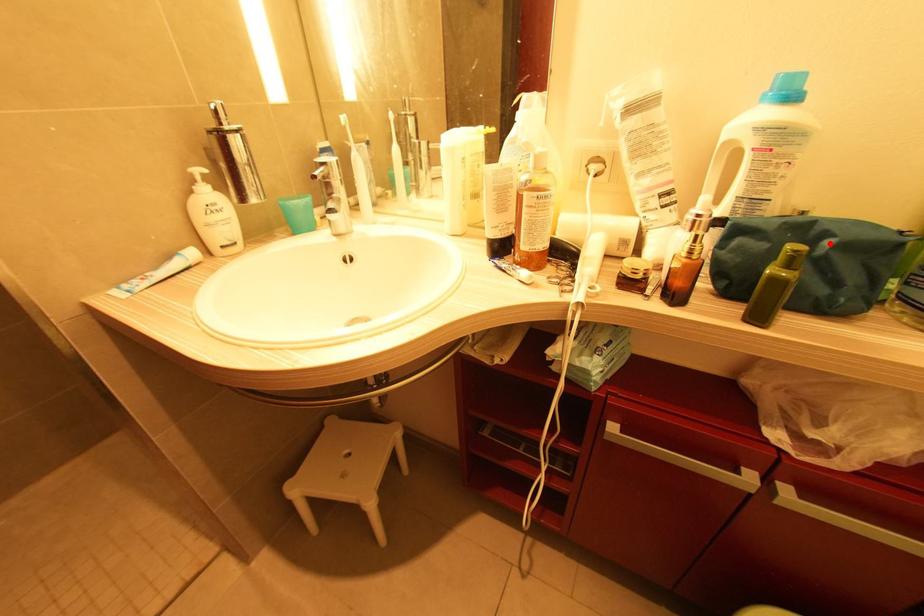
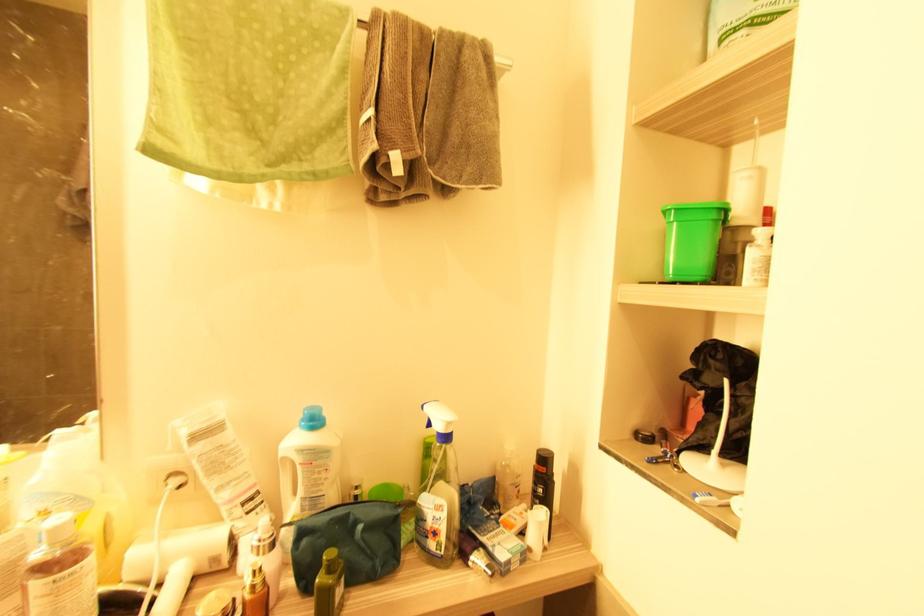
Question: I am providing you with two images of the same scene from different viewpoints. A red point is marked on the first image. Is the red point's position out of view in image 2?

Choices:
 (A) Yes
 (B) No

Answer: (B)